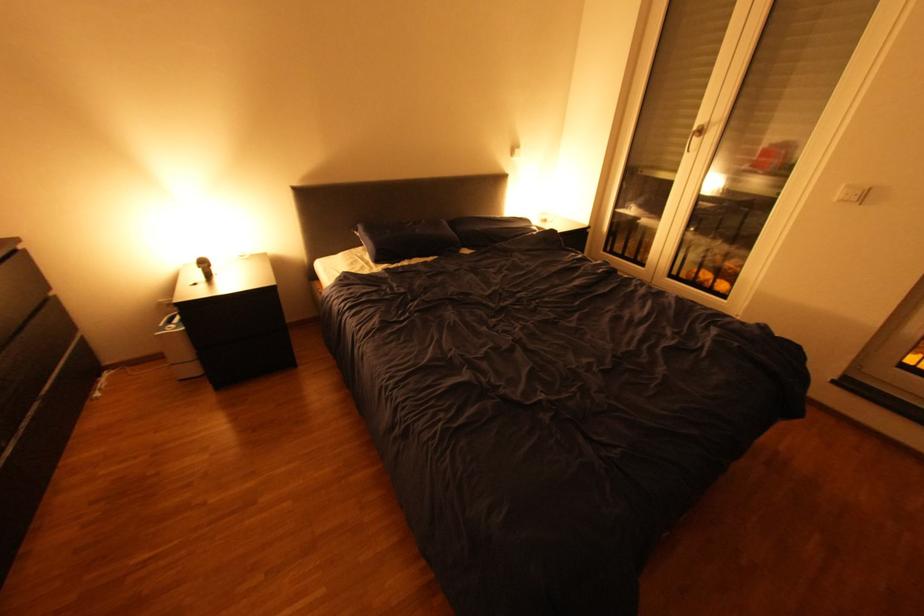
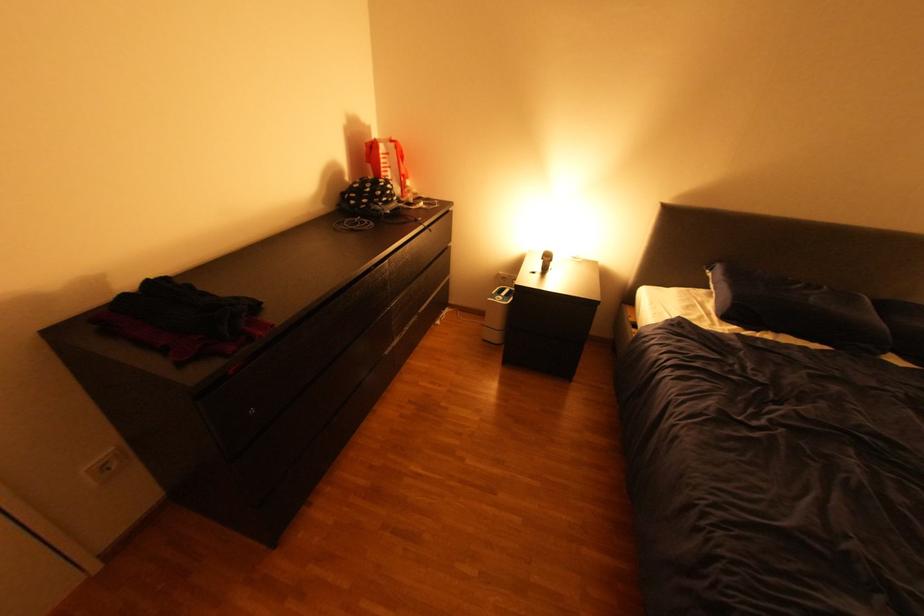
Locate, in the second image, the point that corresponds to (x=222, y=268) in the first image.

(561, 262)